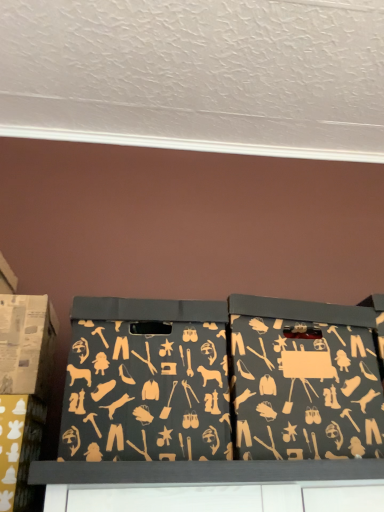
Locate an element on the screen. The width and height of the screenshot is (384, 512). matte cardboard box at left, which appears as the fourth box when viewed from the right is located at coordinates (26, 344).

Between matte black box at center, the first box when ordered from right to left, and matte cardboard box at left, which appears as the fourth box when viewed from the right, which one has smaller width?

With smaller width is matte cardboard box at left, which appears as the fourth box when viewed from the right.

Is matte black box at center, positioned as the fourth box in left-to-right order, not within matte cardboard box at left, positioned as the 1th box in left-to-right order?

Indeed, matte black box at center, positioned as the fourth box in left-to-right order, is completely outside matte cardboard box at left, positioned as the 1th box in left-to-right order.

From the image's perspective, is matte black box at center, the first box when ordered from right to left, under matte cardboard box at left, which appears as the fourth box when viewed from the right?

Yes.

From a real-world perspective, is matte black box at center, the first box when ordered from right to left, above or below matte cardboard box at left, positioned as the 1th box in left-to-right order?

From a real-world perspective, matte black box at center, the first box when ordered from right to left, is physically below matte cardboard box at left, positioned as the 1th box in left-to-right order.

Is the position of matte black storage box at center, the second box viewed from the right, more distant than that of matte black box at center, positioned as the fourth box in left-to-right order?

No.

Is matte black storage box at center, the third box when ordered from left to right, positioned with its back to matte black box at center, positioned as the fourth box in left-to-right order?

No, matte black box at center, positioned as the fourth box in left-to-right order, is not at the back of matte black storage box at center, the third box when ordered from left to right.

Does matte black storage box at center, the second box viewed from the right, appear on the right side of matte black box at center, positioned as the fourth box in left-to-right order?

Incorrect, matte black storage box at center, the second box viewed from the right, is not on the right side of matte black box at center, positioned as the fourth box in left-to-right order.

Between matte black storage box at center, the third box when ordered from left to right, and matte black box at center, positioned as the fourth box in left-to-right order, which one has larger width?

matte black box at center, positioned as the fourth box in left-to-right order, is wider.

Which is less distant, (x=221, y=368) or (x=29, y=426)?

The point (x=221, y=368) is in front.

Could you tell me if matte black storage box at center, the second box viewed from the right, is facing matte black storage bin at lower left, the 3th box viewed from the right?

No, matte black storage box at center, the second box viewed from the right, is not facing towards matte black storage bin at lower left, the 3th box viewed from the right.

Based on the photo, which object is further away from the camera, matte black storage box at center, the second box viewed from the right, or matte black storage bin at lower left, the second box positioned from the left?

matte black storage bin at lower left, the second box positioned from the left, is further from the camera.

Considering the sizes of objects matte cardboard box at left, which appears as the fourth box when viewed from the right, and matte black box at center, the first box when ordered from right to left, in the image provided, who is thinner, matte cardboard box at left, which appears as the fourth box when viewed from the right, or matte black box at center, the first box when ordered from right to left,?

matte cardboard box at left, which appears as the fourth box when viewed from the right, is thinner.

Image resolution: width=384 pixels, height=512 pixels. There is a matte cardboard box at left, which appears as the fourth box when viewed from the right. Identify the location of the 1st box below it (from a real-world perspective). (303, 380).

Looking at this image, is matte cardboard box at left, which appears as the fourth box when viewed from the right, not within matte black box at center, the first box when ordered from right to left?

Indeed, matte cardboard box at left, which appears as the fourth box when viewed from the right, is completely outside matte black box at center, the first box when ordered from right to left.

Can you confirm if matte black box at center, positioned as the fourth box in left-to-right order, is wider than matte black storage bin at lower left, the second box positioned from the left?

Yes.

Can you tell me how much matte black box at center, the first box when ordered from right to left, and matte black storage bin at lower left, the 3th box viewed from the right, differ in facing direction?

3.85e-05 degrees separate the facing orientations of matte black box at center, the first box when ordered from right to left, and matte black storage bin at lower left, the 3th box viewed from the right.

Consider the image. Is matte black box at center, the first box when ordered from right to left, positioned with its back to matte black storage bin at lower left, the second box positioned from the left?

That's not correct — matte black box at center, the first box when ordered from right to left, is not looking away from matte black storage bin at lower left, the second box positioned from the left.

Based on the photo, does matte black box at center, the first box when ordered from right to left, have a greater height compared to matte black storage bin at lower left, the 3th box viewed from the right?

Correct, matte black box at center, the first box when ordered from right to left, is much taller as matte black storage bin at lower left, the 3th box viewed from the right.

From the image's perspective, does matte cardboard box at left, which appears as the fourth box when viewed from the right, appear lower than matte black storage box at center, the second box viewed from the right?

No, from the image's perspective, matte cardboard box at left, which appears as the fourth box when viewed from the right, is not beneath matte black storage box at center, the second box viewed from the right.

Does matte cardboard box at left, which appears as the fourth box when viewed from the right, turn towards matte black storage box at center, the third box when ordered from left to right?

No, matte cardboard box at left, which appears as the fourth box when viewed from the right, is not aimed at matte black storage box at center, the third box when ordered from left to right.

Which object is thinner, matte cardboard box at left, positioned as the 1th box in left-to-right order, or matte black storage box at center, the third box when ordered from left to right?

matte cardboard box at left, positioned as the 1th box in left-to-right order.

From a real-world perspective, is matte cardboard box at left, which appears as the fourth box when viewed from the right, physically located above or below matte black storage box at center, the third box when ordered from left to right?

matte cardboard box at left, which appears as the fourth box when viewed from the right, is above matte black storage box at center, the third box when ordered from left to right.

Is matte black box at center, positioned as the fourth box in left-to-right order, behind matte black storage box at center, the second box viewed from the right?

Yes, it is behind matte black storage box at center, the second box viewed from the right.

Could you tell me if matte black box at center, the first box when ordered from right to left, is facing matte black storage box at center, the third box when ordered from left to right?

No, matte black box at center, the first box when ordered from right to left, is not turned towards matte black storage box at center, the third box when ordered from left to right.

How many degrees apart are the facing directions of matte black box at center, positioned as the fourth box in left-to-right order, and matte black storage box at center, the third box when ordered from left to right?

There is a 0.000139-degree angle between the facing directions of matte black box at center, positioned as the fourth box in left-to-right order, and matte black storage box at center, the third box when ordered from left to right.

Between point (249, 451) and point (143, 338), which one is positioned behind?

The point (143, 338) is farther.

You are a GUI agent. You are given a task and a screenshot of the screen. Output one action in this format:
    pyautogui.click(x=<x>, y=<y>)
    Task: Click on the 2nd box above the matte black box at center, the first box when ordered from right to left (from the image's perspective)
    This screenshot has width=384, height=512.
    Given the screenshot: What is the action you would take?
    pyautogui.click(x=26, y=344)

You are a GUI agent. You are given a task and a screenshot of the screen. Output one action in this format:
    pyautogui.click(x=<x>, y=<y>)
    Task: Click on the 1st box directly above the matte black storage box at center, the second box viewed from the right (from a real-world perspective)
    
    Given the screenshot: What is the action you would take?
    pyautogui.click(x=303, y=380)

Based on their spatial positions, is matte cardboard box at left, which appears as the fourth box when viewed from the right, or matte black box at center, the first box when ordered from right to left, further from matte black storage box at center, the third box when ordered from left to right?

matte cardboard box at left, which appears as the fourth box when viewed from the right, lies further to matte black storage box at center, the third box when ordered from left to right, than the other object.

Looking at the image, which one is located closer to matte cardboard box at left, which appears as the fourth box when viewed from the right, matte black storage bin at lower left, the 3th box viewed from the right, or matte black storage box at center, the second box viewed from the right?

matte black storage bin at lower left, the 3th box viewed from the right.

In the scene shown: Based on their spatial positions, is matte black box at center, the first box when ordered from right to left, or matte black storage bin at lower left, the 3th box viewed from the right, further from matte black storage box at center, the third box when ordered from left to right?

matte black storage bin at lower left, the 3th box viewed from the right, is positioned further to the anchor matte black storage box at center, the third box when ordered from left to right.

Based on their spatial positions, is matte cardboard box at left, positioned as the 1th box in left-to-right order, or matte black storage box at center, the second box viewed from the right, further from matte black storage bin at lower left, the 3th box viewed from the right?

matte black storage box at center, the second box viewed from the right, lies further to matte black storage bin at lower left, the 3th box viewed from the right, than the other object.

Estimate the real-world distances between objects in this image. Which object is closer to matte black storage bin at lower left, the 3th box viewed from the right, matte black storage box at center, the third box when ordered from left to right, or matte cardboard box at left, positioned as the 1th box in left-to-right order?

The object closer to matte black storage bin at lower left, the 3th box viewed from the right, is matte cardboard box at left, positioned as the 1th box in left-to-right order.

From the image, which object appears to be nearer to matte black box at center, the first box when ordered from right to left, matte black storage box at center, the third box when ordered from left to right, or matte cardboard box at left, which appears as the fourth box when viewed from the right?

matte black storage box at center, the third box when ordered from left to right, lies closer to matte black box at center, the first box when ordered from right to left, than the other object.

From the picture: When comparing their distances from matte black storage box at center, the second box viewed from the right, does matte black storage bin at lower left, the second box positioned from the left, or matte cardboard box at left, which appears as the fourth box when viewed from the right, seem closer?

matte cardboard box at left, which appears as the fourth box when viewed from the right.

Estimate the real-world distances between objects in this image. Which object is further from matte cardboard box at left, which appears as the fourth box when viewed from the right, matte black storage box at center, the third box when ordered from left to right, or matte black box at center, the first box when ordered from right to left?

matte black box at center, the first box when ordered from right to left, is positioned further to the anchor matte cardboard box at left, which appears as the fourth box when viewed from the right.

This screenshot has height=512, width=384. In order to click on box between matte black storage bin at lower left, the 3th box viewed from the right, and matte black box at center, positioned as the fourth box in left-to-right order, in the horizontal direction in this screenshot , I will do `click(146, 381)`.

This screenshot has height=512, width=384. I want to click on box between matte cardboard box at left, positioned as the 1th box in left-to-right order, and matte black storage box at center, the third box when ordered from left to right, in the horizontal direction, so click(x=19, y=448).